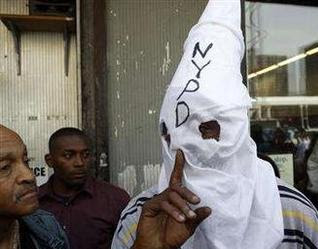
Find the location of a particular element. This screenshot has height=249, width=318. wall of side/wall is located at coordinates (46, 92).